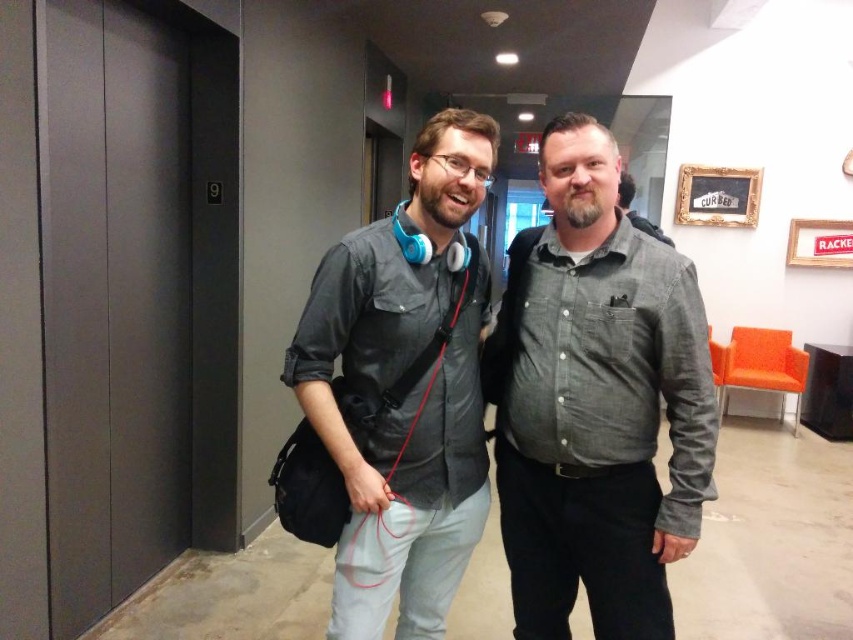
Can you confirm if matte gray elevator at left is positioned above matte gray shirt at center?

Indeed, matte gray elevator at left is positioned over matte gray shirt at center.

Is point (184, 520) in front of point (340, 417)?

No, it is not.

Identify the location of matte gray elevator at left. The width and height of the screenshot is (853, 640). (114, 300).

Is gray cotton shirt at center thinner than matte gray shirt at center?

Correct, gray cotton shirt at center's width is less than matte gray shirt at center's.

Identify the location of gray cotton shirt at center. (596, 403).

Does matte gray elevator at left lie in front of gray cotton shirt at center?

That is False.

Is point (166, 12) less distant than point (686, 396)?

No.

Locate an element on the screen. This screenshot has height=640, width=853. matte gray elevator at left is located at coordinates (114, 300).